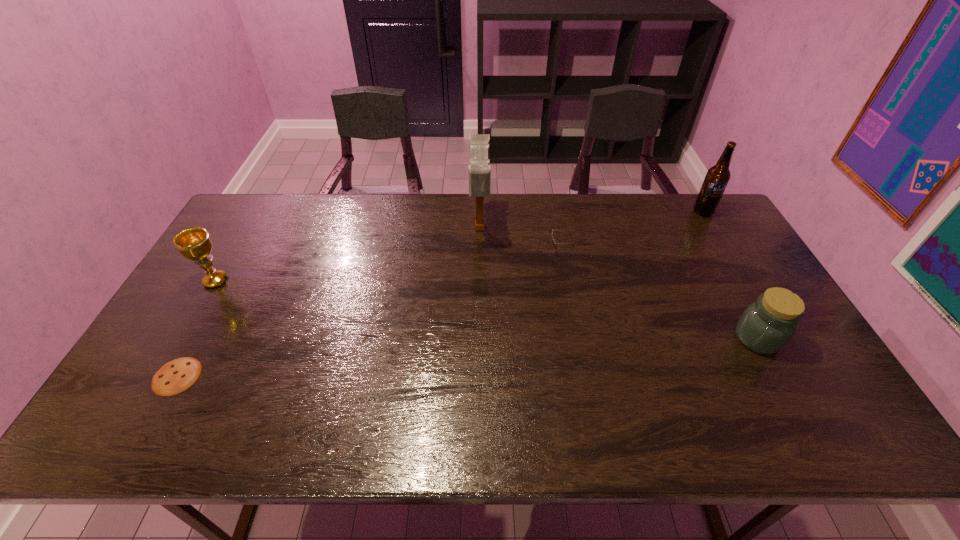
I want to click on free space that satisfies the following two spatial constraints: 1. on the label of the beer bottle; 2. in front of the lenses of the fifth tallest object, so click(726, 251).

What are the coordinates of `vacant space that satisfies the following two spatial constraints: 1. on the back side of the third nearest object; 2. on the left side of the third object from left to right` in the screenshot? It's located at (247, 228).

Identify the location of vacant point that satisfies the following two spatial constraints: 1. in front of the lenses of the third object from right to left; 2. on the back side of the jar. (577, 338).